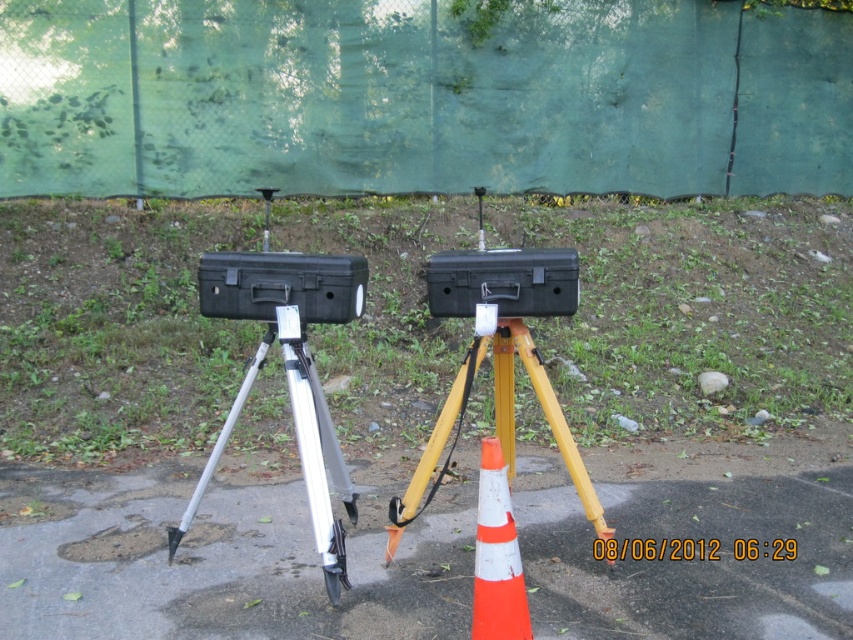
Does silver metallic tripod at center have a lesser width compared to black hard case at center?

In fact, silver metallic tripod at center might be wider than black hard case at center.

Who is higher up, silver metallic tripod at center or black hard case at center?

black hard case at center is above.

Which is behind, point (328, 593) or point (554, 307)?

The point (554, 307) is more distant.

You are a GUI agent. You are given a task and a screenshot of the screen. Output one action in this format:
    pyautogui.click(x=<x>, y=<y>)
    Task: Click on the silver metallic tripod at center
    
    Given the screenshot: What is the action you would take?
    pyautogui.click(x=297, y=448)

Is point (337, 579) positioned in front of point (488, 440)?

No, it is behind (488, 440).

In the scene shown: Between silver metallic tripod at center and orange/white plastic traffic cone at center, which one appears on the left side from the viewer's perspective?

silver metallic tripod at center is more to the left.

Between point (309, 410) and point (520, 572), which one is positioned behind?

The point (309, 410) is more distant.

Identify the location of silver metallic tripod at center. This screenshot has height=640, width=853. point(297,448).

Is smooth asphalt pavement at center positioned at the back of orange/white plastic traffic cone at center?

Yes, it is behind orange/white plastic traffic cone at center.

Who is higher up, smooth asphalt pavement at center or orange/white plastic traffic cone at center?

orange/white plastic traffic cone at center is above.

What do you see at coordinates (229, 572) in the screenshot?
I see `smooth asphalt pavement at center` at bounding box center [229, 572].

This screenshot has height=640, width=853. Find the location of `smooth asphalt pavement at center`. smooth asphalt pavement at center is located at coordinates (229, 572).